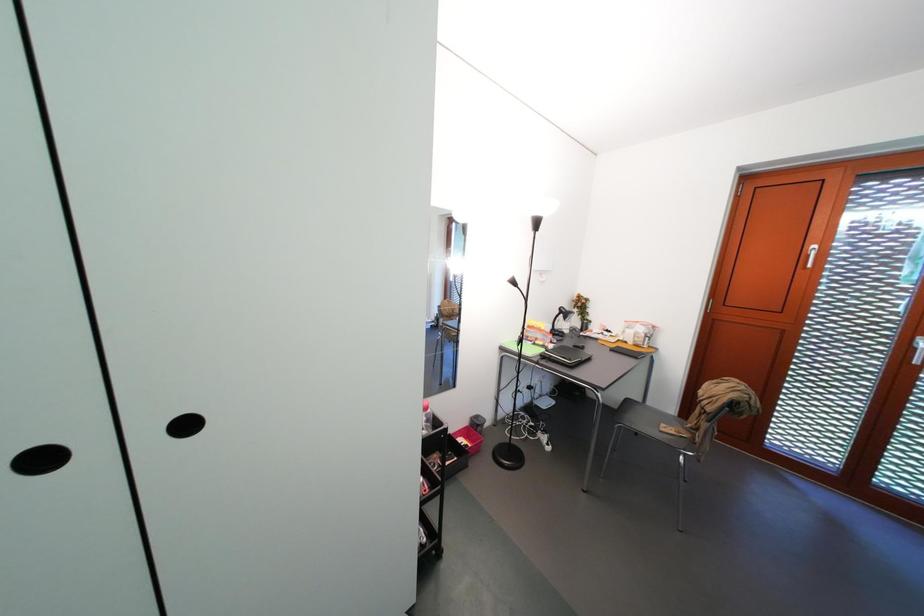
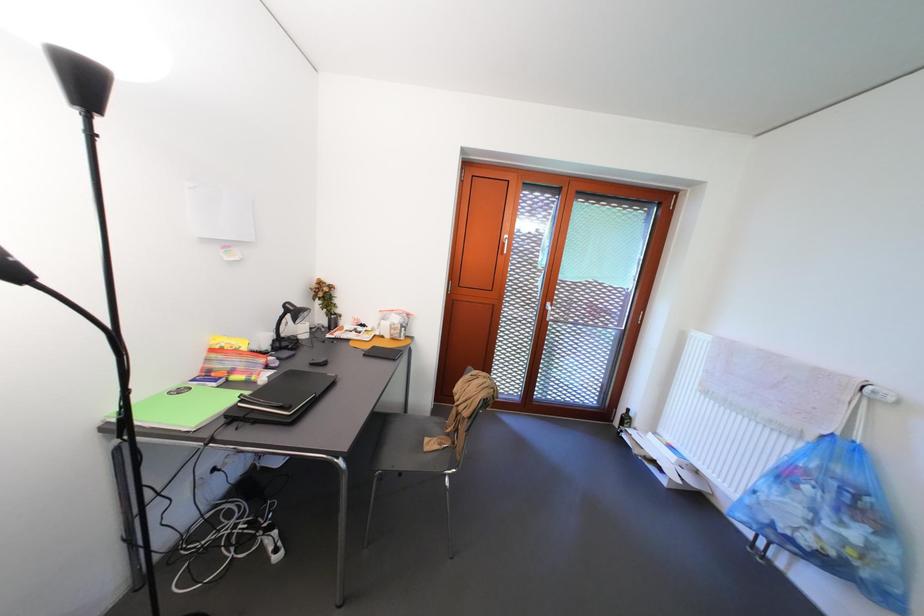
Question: How did the camera likely rotate?

Choices:
 (A) Left
 (B) Right
 (C) Up
 (D) Down

Answer: (B)